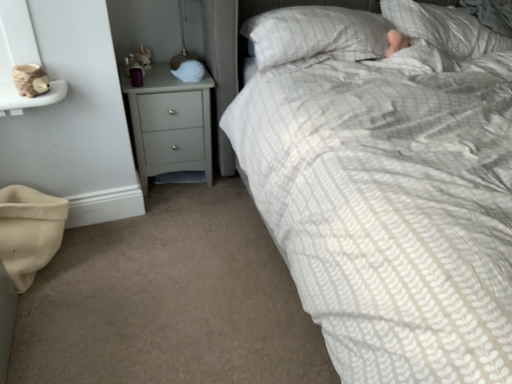
Question: Relative to white textured pillow at upper right, arranged as the first pillow when viewed from the right, is matte gray chest of drawers at center-left in front or behind?

Choices:
 (A) front
 (B) behind

Answer: (B)

Question: In terms of width, does matte gray chest of drawers at center-left look wider or thinner when compared to white textured pillow at upper right, arranged as the first pillow when viewed from the right?

Choices:
 (A) wide
 (B) thin

Answer: (B)

Question: Which object is the closest to the white textured pillow at upper right, arranged as the first pillow when viewed from the right?

Choices:
 (A) white textured pillow at upper center, arranged as the 1th pillow when viewed from the left
 (B) matte gray chest of drawers at center-left

Answer: (A)

Question: Estimate the real-world distances between objects in this image. Which object is farther from the white textured pillow at upper right, arranged as the first pillow when viewed from the right?

Choices:
 (A) white textured pillow at upper center, positioned as the 2th pillow in right-to-left order
 (B) matte gray chest of drawers at center-left

Answer: (B)